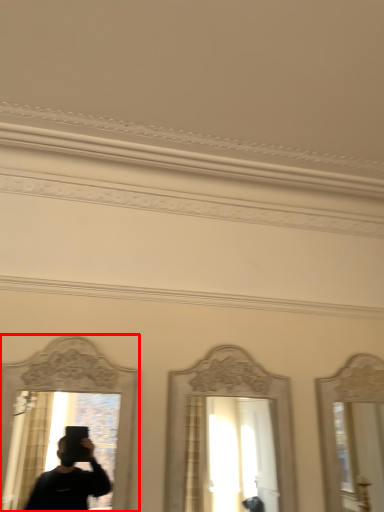
Question: From the image's perspective, considering the relative positions of mirror (annotated by the red box) and mirror in the image provided, where is mirror (annotated by the red box) located with respect to the staircase?

Choices:
 (A) above
 (B) below

Answer: (A)